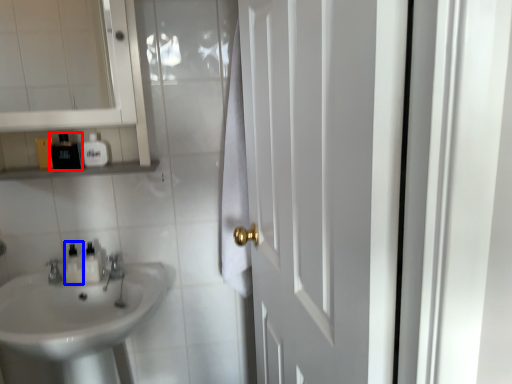
Question: Which point is closer to the camera, toiletry (highlighted by a red box) or toiletry (highlighted by a blue box)?

Choices:
 (A) toiletry
 (B) toiletry

Answer: (A)